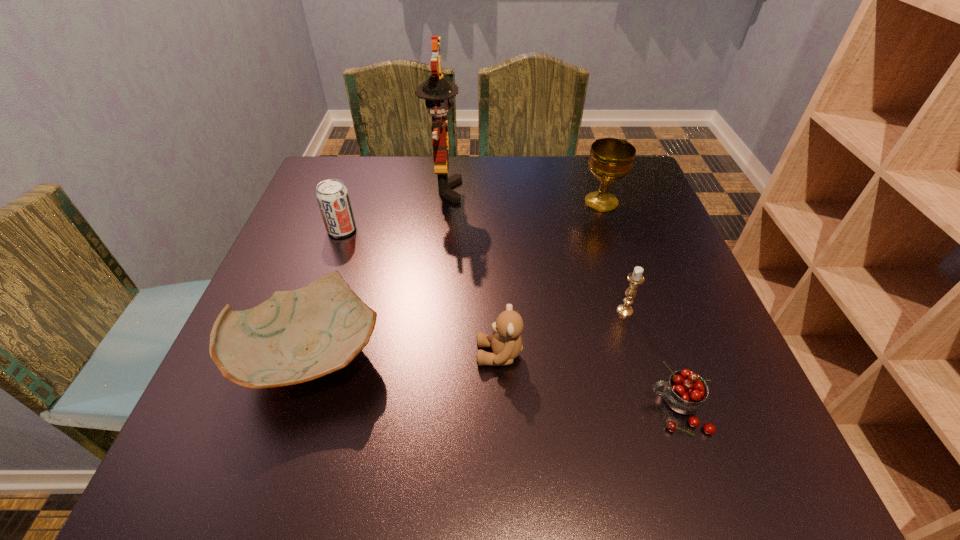
Locate an element on the screen. This screenshot has width=960, height=540. chalice present at the far edge is located at coordinates (611, 159).

The width and height of the screenshot is (960, 540). Identify the location of object situated at the near edge. (685, 392).

The width and height of the screenshot is (960, 540). Identify the location of soda can that is at the left edge. (333, 199).

You are a GUI agent. You are given a task and a screenshot of the screen. Output one action in this format:
    pyautogui.click(x=<x>, y=<y>)
    Task: Click on the pottery present at the left edge
    
    Given the screenshot: What is the action you would take?
    pyautogui.click(x=295, y=336)

You are a GUI agent. You are given a task and a screenshot of the screen. Output one action in this format:
    pyautogui.click(x=<x>, y=<y>)
    Task: Click on the chalice positioned at the right edge
    
    Given the screenshot: What is the action you would take?
    pyautogui.click(x=611, y=159)

Where is `candle holder that is positioned at the right edge`? This screenshot has height=540, width=960. candle holder that is positioned at the right edge is located at coordinates (635, 278).

You are a GUI agent. You are given a task and a screenshot of the screen. Output one action in this format:
    pyautogui.click(x=<x>, y=<y>)
    Task: Click on the cherry present at the right edge
    The height and width of the screenshot is (540, 960).
    Given the screenshot: What is the action you would take?
    pyautogui.click(x=685, y=392)

Locate an element on the screen. This screenshot has width=960, height=540. object present at the far right corner is located at coordinates (611, 159).

Image resolution: width=960 pixels, height=540 pixels. What are the coordinates of `object located in the near right corner section of the desktop` in the screenshot? It's located at (685, 392).

I want to click on vacant area at the far edge, so click(x=555, y=173).